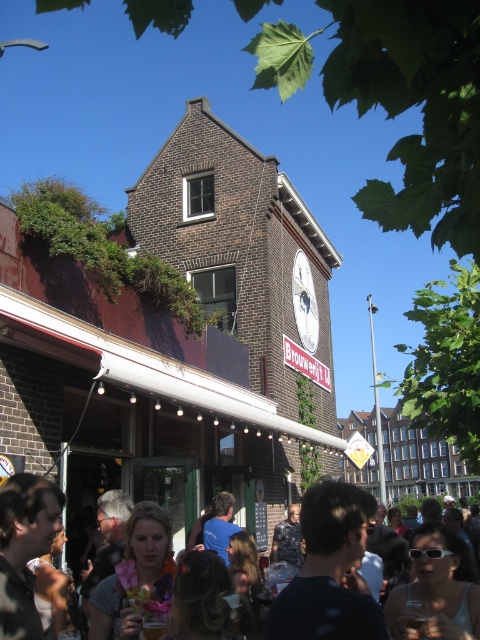
You are a photographer trying to capture the scene in front of the brick building. You notice the matte black hair at center and the metallic pole at center in your frame. Which object should you adjust your camera angle to focus on if you want to highlight the wider object?

The metallic pole at center is wider than the matte black hair at center, so you should adjust your camera angle to focus on the metallic pole at center to highlight the wider object.

You are a photographer standing in front of the brick building. You want to take a photo of the matte black hair at center and the metallic pole at center. Which object should you focus on first if you want to capture both in the same frame without moving the camera?

The matte black hair at center has a lesser height compared to the metallic pole at center, so you should focus on the metallic pole at center first as it is taller and will be easier to frame.

You are a photographer trying to capture a photo of the matte black hair at center and metallic pole at center. Which object should you zoom in more on to ensure both are clearly visible in the frame?

Since the matte black hair at center is smaller than the metallic pole at center, you should zoom in more on the matte black hair at center to ensure both are clearly visible in the frame.